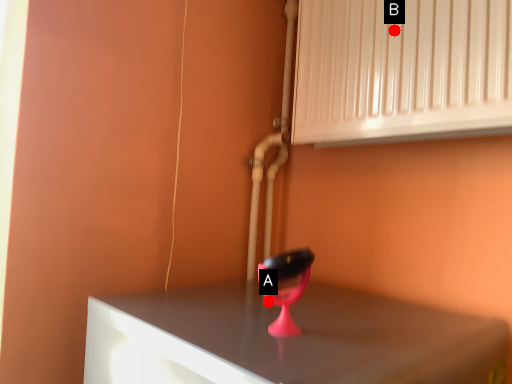
Question: Two points are circled on the image, labeled by A and B beside each circle. Which point is closer to the camera?

Choices:
 (A) A is closer
 (B) B is closer

Answer: (A)